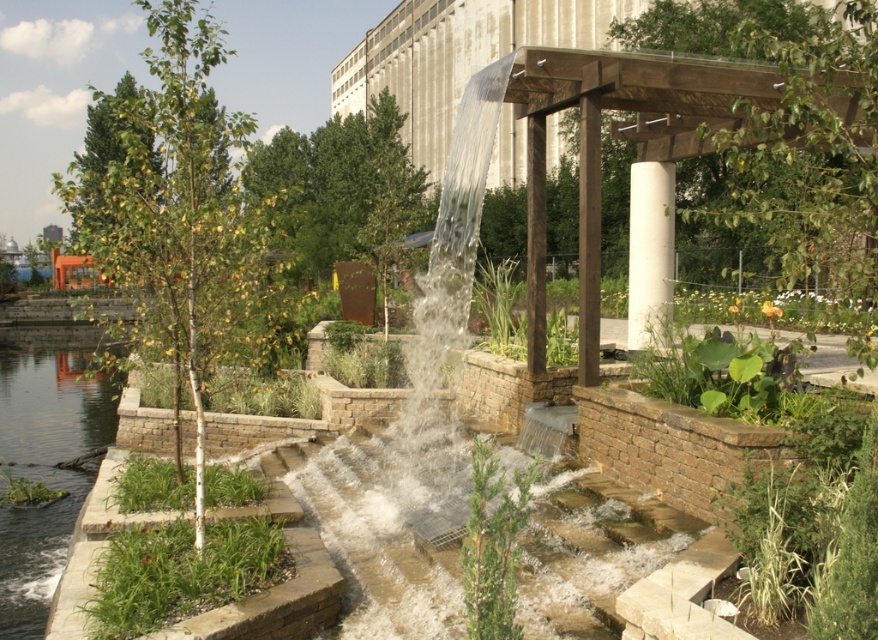
You are standing at the entrance of the park and notice the clear water at lower left. Based on its coordinates, can you determine if it is positioned to your left or right side?

The clear water at lower left is located at point 0.714 on the x axis and 0.052 on the y axis. Since the x value is closer to 1, it is positioned to your right side.

You are a landscape architect designing a new pathway between the clear water at lower left and the white smooth column at center. Given that the minimum required distance for accessibility is 15 meters, will your proposed path between them meet the requirement?

The clear water at lower left and the white smooth column at center are 16.27 meters apart, so the proposed path will meet the accessibility requirement since it exceeds the minimum distance of 15 meters.